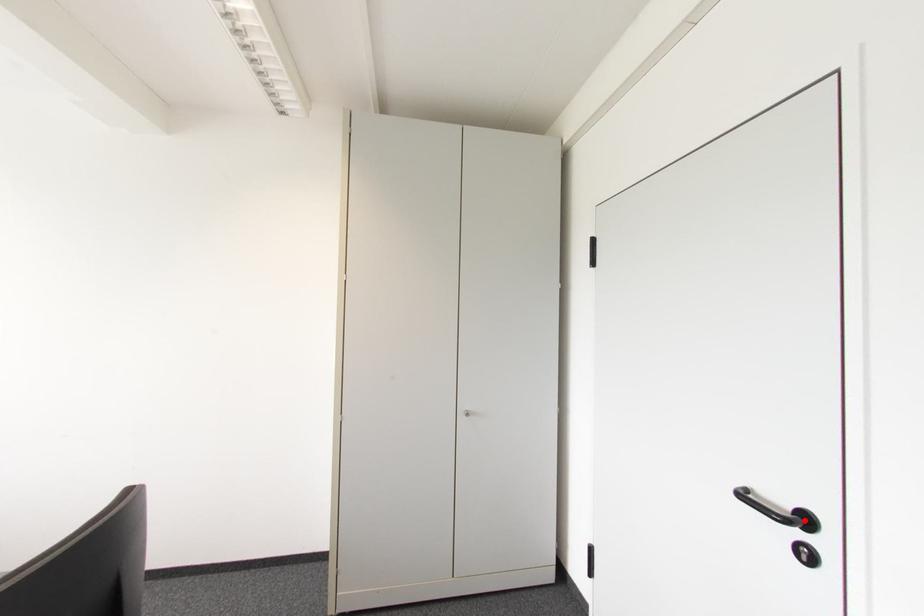
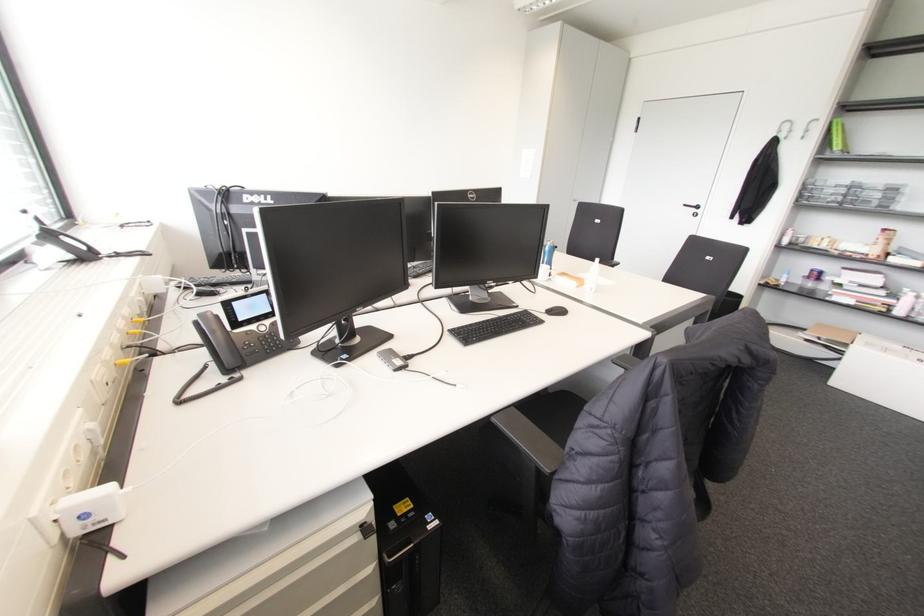
Where in the second image is the point corresponding to the highlighted location from the first image?

(697, 207)